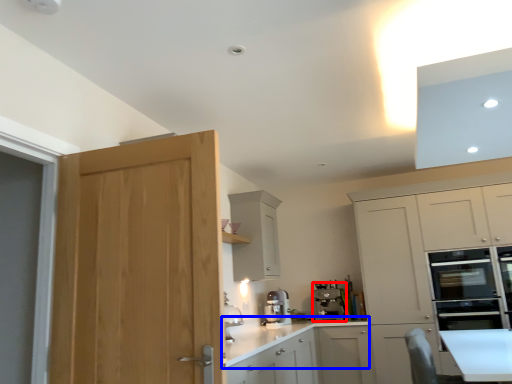
Question: Which of the following is the farthest to the observer, kitchen appliance (highlighted by a red box) or countertop (highlighted by a blue box)?

Choices:
 (A) kitchen appliance
 (B) countertop

Answer: (A)